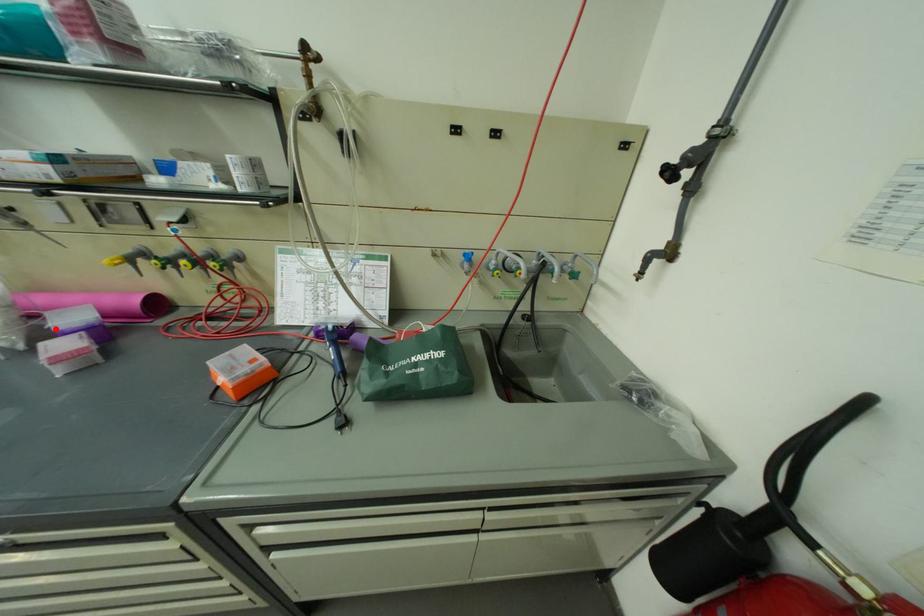
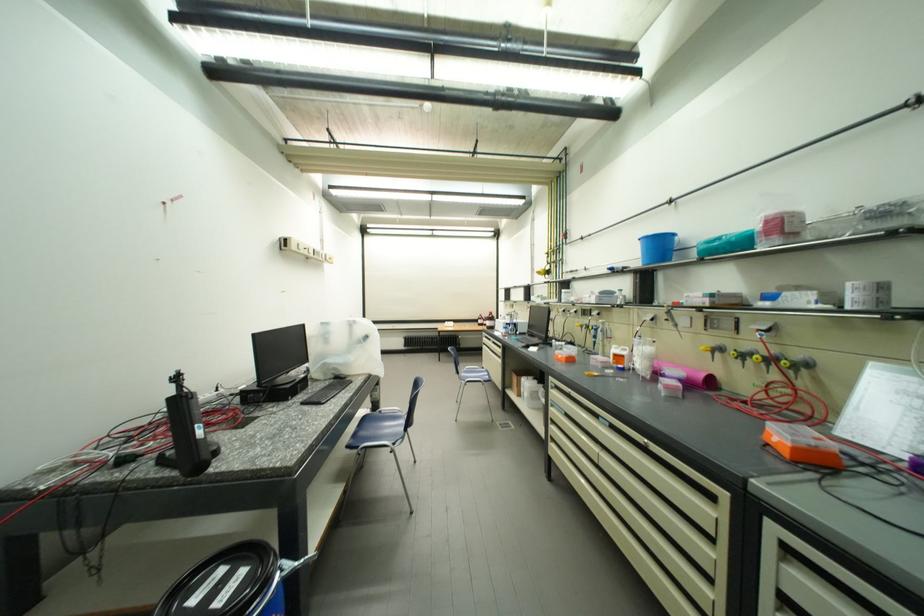
Locate, in the second image, the point that corresponds to the highlighted location in the first image.

(672, 374)